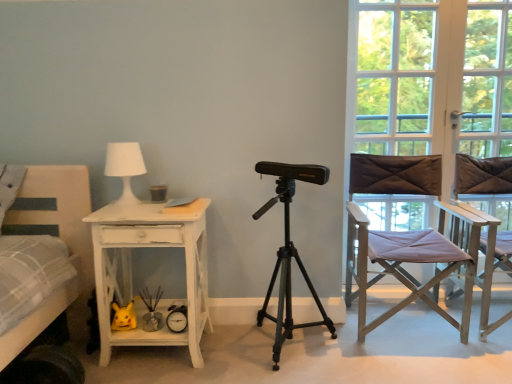
Locate an element on the screen. This screenshot has width=512, height=384. empty space that is ontop of white glass window frame at right (from a real-world perspective) is located at coordinates (442, 0).